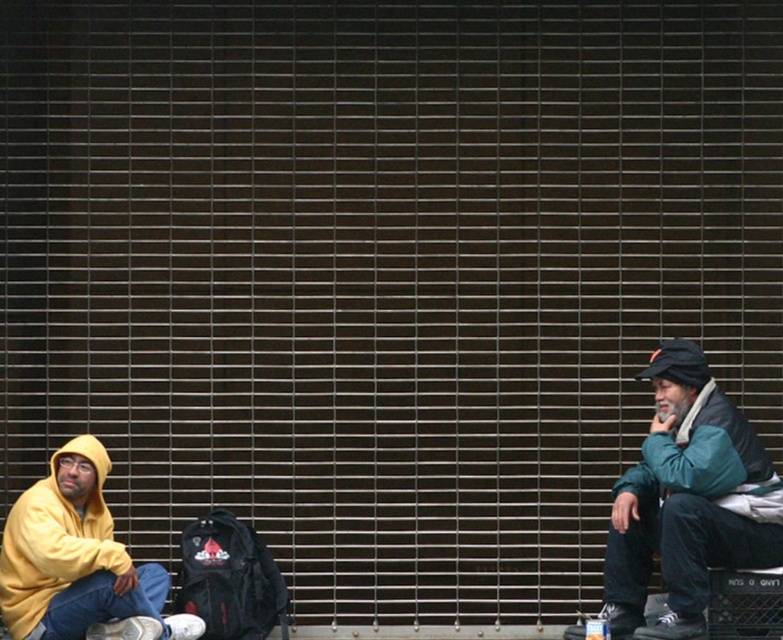
Question: Which of the following is the farthest from the observer?

Choices:
 (A) teal fleece jacket at right
 (B) matte yellow hoodie at lower left

Answer: (B)

Question: Can you confirm if teal fleece jacket at right is wider than matte yellow hoodie at lower left?

Choices:
 (A) yes
 (B) no

Answer: (A)

Question: Is teal fleece jacket at right smaller than matte yellow hoodie at lower left?

Choices:
 (A) yes
 (B) no

Answer: (B)

Question: Can you confirm if teal fleece jacket at right is positioned to the left of matte yellow hoodie at lower left?

Choices:
 (A) yes
 (B) no

Answer: (B)